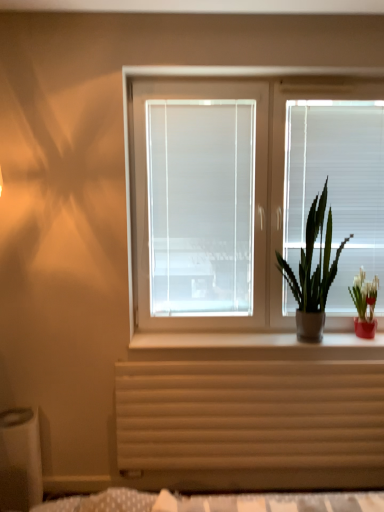
Where is `blank space situated above white matte window at center (from a real-world perspective)`? blank space situated above white matte window at center (from a real-world perspective) is located at coordinates (273, 78).